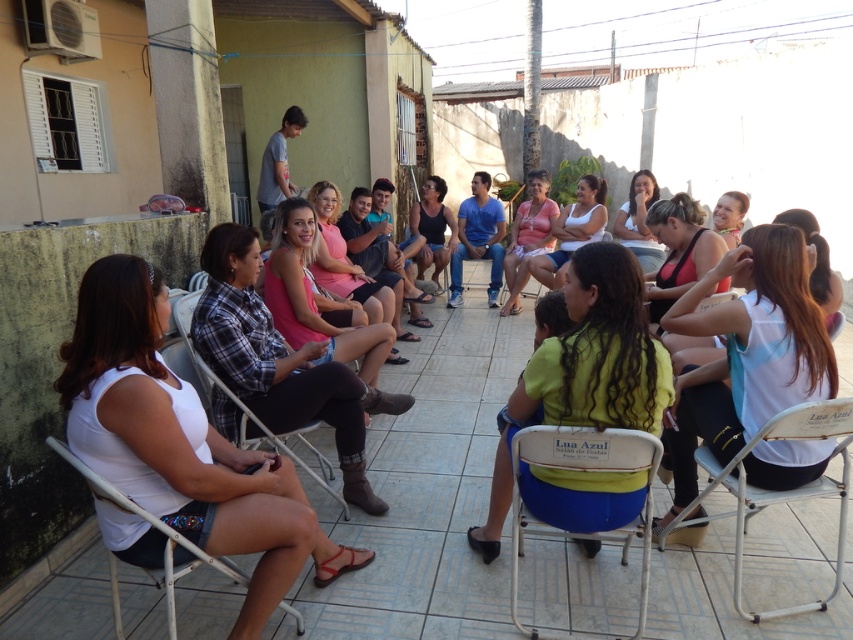
You are a photographer trying to capture a closeup of the yellow fabric shirt at center without including the metallic silver chair at center in the frame. Based on their positions, is this possible?

The yellow fabric shirt at center is below the metallic silver chair at center, so it is possible to capture a closeup of the yellow fabric shirt at center without including the metallic silver chair at center by framing the shot to exclude the chair above it.